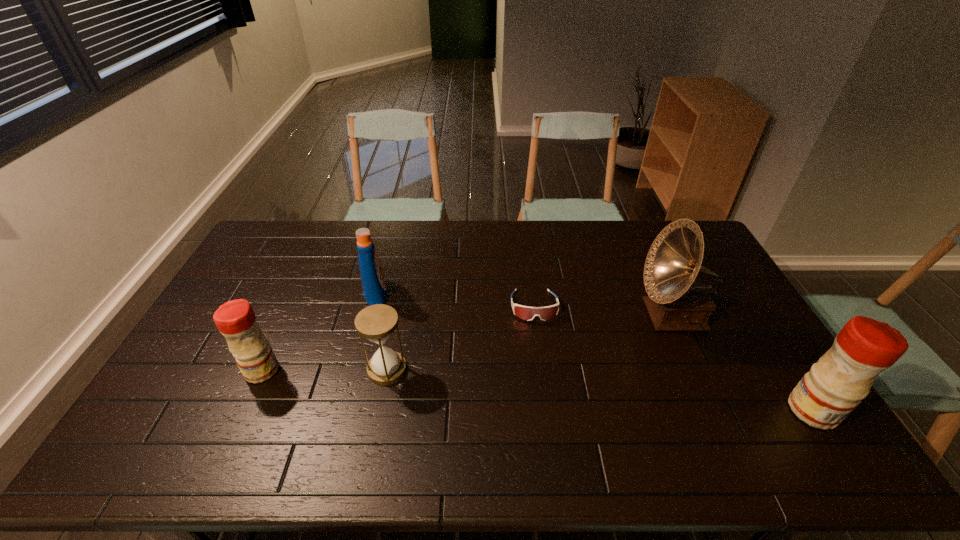
Find the location of `blank region between the fifth object from left to right and the leftmost object`. blank region between the fifth object from left to right and the leftmost object is located at coordinates (468, 343).

This screenshot has height=540, width=960. Find the location of `vacant point located between the shortest object and the detergent`. vacant point located between the shortest object and the detergent is located at coordinates (455, 300).

The height and width of the screenshot is (540, 960). Identify the location of free space between the goggles and the phonograph record. (604, 310).

The height and width of the screenshot is (540, 960). What are the coordinates of `empty location between the shortest object and the detergent` in the screenshot? It's located at (455, 300).

You are a GUI agent. You are given a task and a screenshot of the screen. Output one action in this format:
    pyautogui.click(x=<x>, y=<y>)
    Task: Click on the fourth closest object to the shortest object
    The image size is (960, 540).
    Given the screenshot: What is the action you would take?
    pyautogui.click(x=835, y=385)

Identify which object is the fifth nearest to the hourglass. Please provide its 2D coordinates. Your answer should be formatted as a tuple, i.e. [(x, y)], where the tuple contains the x and y coordinates of a point satisfying the conditions above.

[(835, 385)]

This screenshot has height=540, width=960. In order to click on vacant space that satisfies the following two spatial constraints: 1. on the horn of the fifth object from left to right; 2. on the front side of the hourglass in this screenshot , I will do `click(698, 369)`.

Image resolution: width=960 pixels, height=540 pixels. What are the coordinates of `vacant space that satisfies the following two spatial constraints: 1. on the back side of the rightmost object; 2. on the horn of the second object from right to left` in the screenshot? It's located at (752, 315).

Where is `vacant point that satisfies the following two spatial constraints: 1. on the label of the detergent; 2. on the right side of the right condiment`? vacant point that satisfies the following two spatial constraints: 1. on the label of the detergent; 2. on the right side of the right condiment is located at coordinates (346, 410).

Locate an element on the screen. free space that satisfies the following two spatial constraints: 1. on the front-facing side of the nearer condiment; 2. on the left side of the goggles is located at coordinates (547, 410).